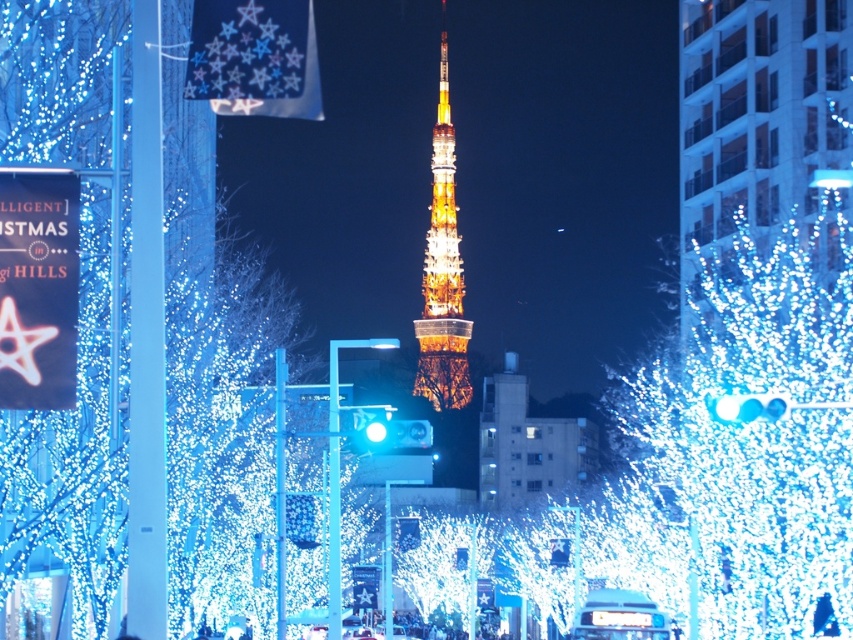
You are standing in front of the festive scene and want to take a photo of both the illuminated glass tower at center and the illuminated metal tower at center. Which tower should you focus on first to ensure both are in the frame?

You should focus on the illuminated glass tower at center first since it is closer to the viewer than the illuminated metal tower at center, allowing both to be captured in the frame.

You are a photographer trying to capture the illuminated glass tower at center and the blue frosted bulb at center in a single shot. Which object should you focus on first to ensure both are in frame?

The illuminated glass tower at center is positioned over the blue frosted bulb at center, so you should focus on the blue frosted bulb at center first to ensure both are in frame.